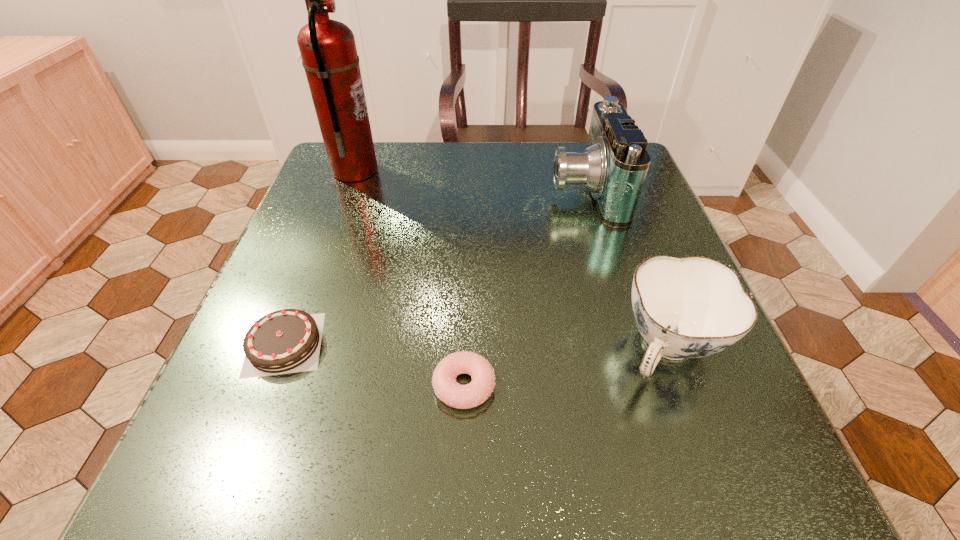
Identify the location of vacant space that's between the camcorder and the doughnut. (524, 287).

Find the location of `free space that is in between the chocolate cake and the doughnut`. free space that is in between the chocolate cake and the doughnut is located at coordinates (374, 365).

Identify the location of vacant space that is in between the fire extinguisher and the third tallest object. The image size is (960, 540). (512, 259).

Locate an element on the screen. vacant area that lies between the second tallest object and the tallest object is located at coordinates (469, 180).

Locate an element on the screen. Image resolution: width=960 pixels, height=540 pixels. vacant area that lies between the third shortest object and the tallest object is located at coordinates (512, 259).

I want to click on free area in between the third tallest object and the fire extinguisher, so click(x=512, y=259).

Locate an element on the screen. free space between the third object from left to right and the camcorder is located at coordinates (524, 287).

Where is `object that is the second nearest to the fire extinguisher`? object that is the second nearest to the fire extinguisher is located at coordinates (614, 165).

Find the location of a particular element. object that can be found as the fourth closest to the chocolate cake is located at coordinates (614, 165).

Locate an element on the screen. This screenshot has height=540, width=960. free point that satisfies the following two spatial constraints: 1. on the front side of the chocolate cake; 2. on the right side of the third tallest object is located at coordinates (283, 348).